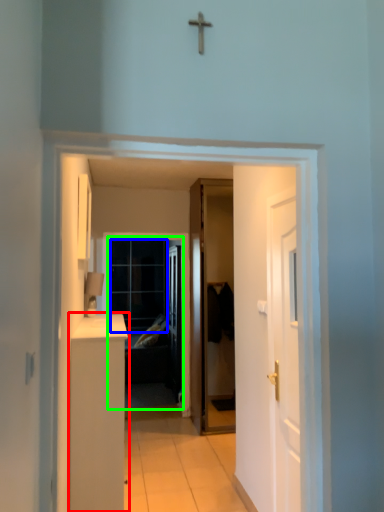
Question: Based on their relative distances, which object is farther from cabinetry (highlighted by a red box)? Choose from glass door (highlighted by a blue box) and screen door (highlighted by a green box).

Choices:
 (A) glass door
 (B) screen door

Answer: (B)